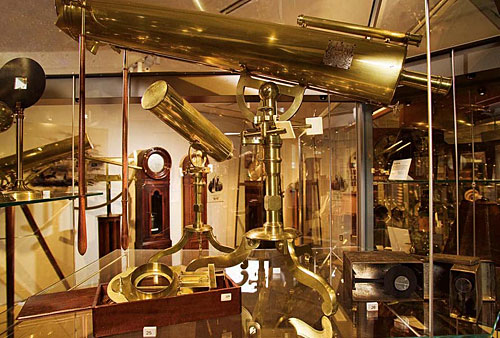
I want to click on shelving, so click(x=480, y=129), click(x=482, y=177).